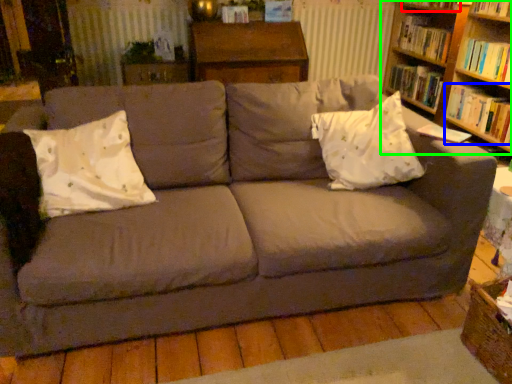
Question: Estimate the real-world distances between objects in this image. Which object is farther from book (highlighted by a red box), book (highlighted by a blue box) or bookcase (highlighted by a green box)?

Choices:
 (A) book
 (B) bookcase

Answer: (A)